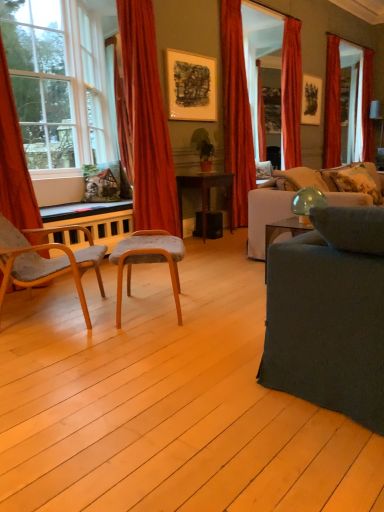
Locate an element on the screen. vacant space to the right of gray fabric stool at center, the 2th chair positioned from the left is located at coordinates (222, 308).